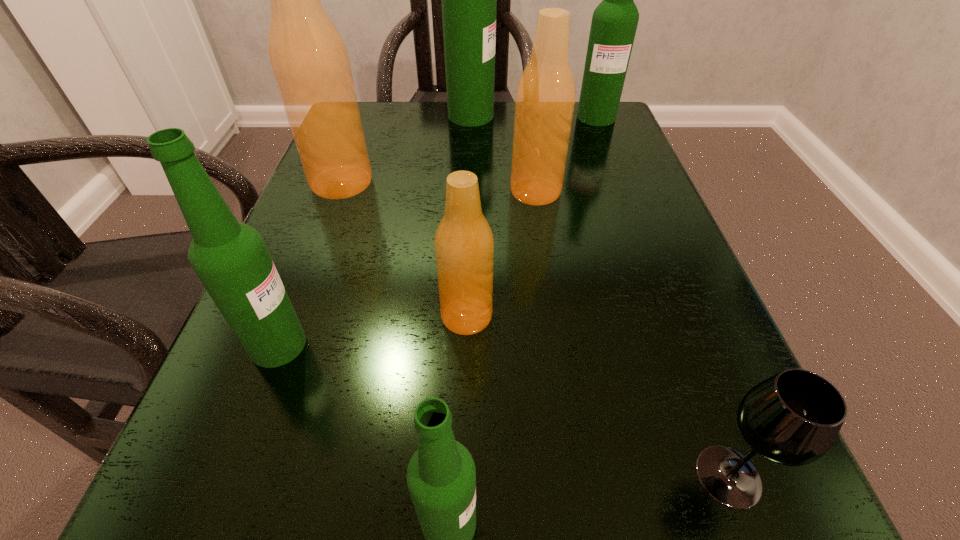
Locate an element on the screen. the fourth closest object to the shortest object is located at coordinates (230, 258).

Identify the location of the fifth closest beer bottle to the leftmost green beer bottle. (469, 0).

Select which beer bottle is the second closest to the biggest green beer bottle. Please provide its 2D coordinates. Your answer should be formatted as a tuple, i.e. [(x, y)], where the tuple contains the x and y coordinates of a point satisfying the conditions above.

[(545, 97)]

Identify the location of green beer bottle that is the closest to the wineglass. This screenshot has height=540, width=960. (441, 476).

Identify which green beer bottle is the second nearest to the second tan beer bottle from left to right. Please provide its 2D coordinates. Your answer should be formatted as a tuple, i.e. [(x, y)], where the tuple contains the x and y coordinates of a point satisfying the conditions above.

[(441, 476)]

The width and height of the screenshot is (960, 540). I want to click on tan beer bottle that is the second closest to the gray wineglass, so click(x=545, y=97).

Locate which tan beer bottle is the closest to the second smallest green beer bottle. Please provide its 2D coordinates. Your answer should be formatted as a tuple, i.e. [(x, y)], where the tuple contains the x and y coordinates of a point satisfying the conditions above.

[(464, 244)]

Identify the location of free space in the image that satisfies the following two spatial constraints: 1. on the back side of the shortest object; 2. on the label of the tallest object. The height and width of the screenshot is (540, 960). (592, 116).

This screenshot has width=960, height=540. I want to click on free space that satisfies the following two spatial constraints: 1. on the label of the rightmost green beer bottle; 2. on the label of the third biggest green beer bottle, so click(x=685, y=345).